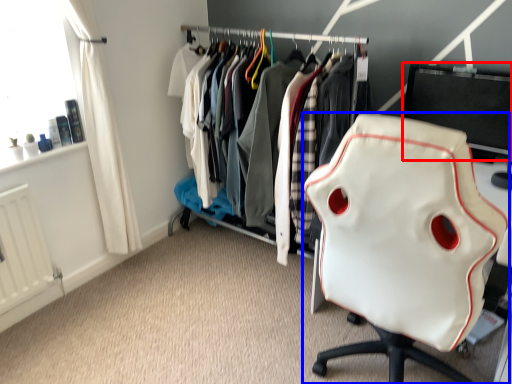
Question: Which of the following is the farthest to the observer, desktop (highlighted by a red box) or chair (highlighted by a blue box)?

Choices:
 (A) desktop
 (B) chair

Answer: (A)